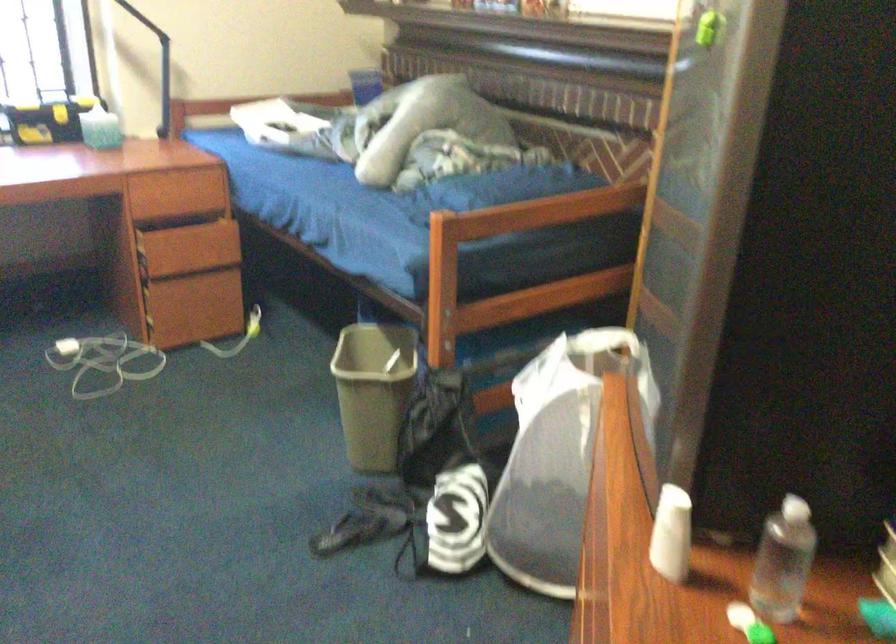
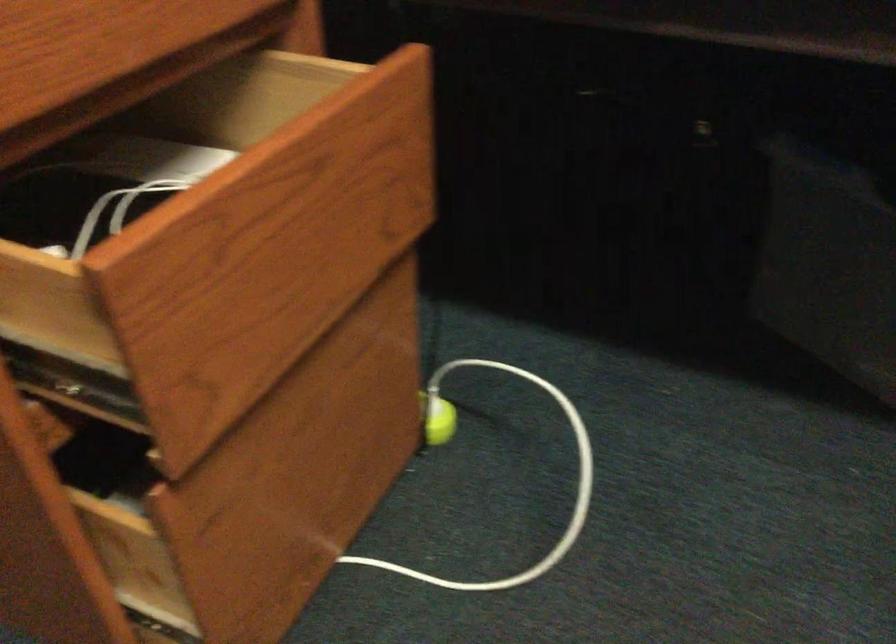
The point at (x=255, y=327) is marked in the first image. Where is the corresponding point in the second image?

(437, 420)